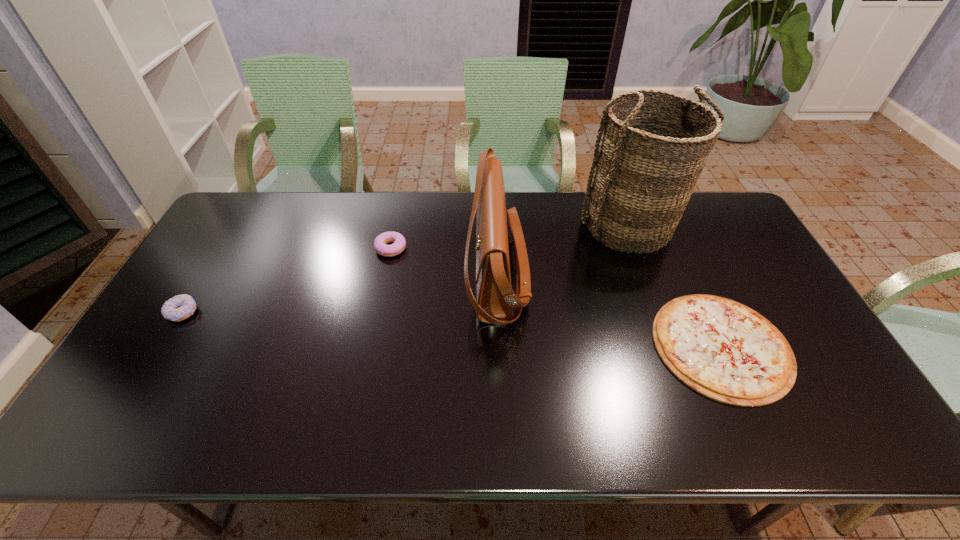
This screenshot has width=960, height=540. Find the location of `vacant position at the near edge of the desktop`. vacant position at the near edge of the desktop is located at coordinates (699, 444).

Where is `vacant space at the left edge of the desktop`? This screenshot has width=960, height=540. vacant space at the left edge of the desktop is located at coordinates (200, 282).

Locate an element on the screen. The height and width of the screenshot is (540, 960). vacant space at the right edge of the desktop is located at coordinates (810, 339).

The width and height of the screenshot is (960, 540). In the image, there is a desktop. What are the coordinates of `vacant space at the far right corner` in the screenshot? It's located at (690, 211).

This screenshot has height=540, width=960. What are the coordinates of `unoccupied area between the left doughnut and the basket` in the screenshot? It's located at (406, 269).

Identify the location of free spot between the second object from left to right and the shortest object. The image size is (960, 540). (556, 297).

What are the coordinates of `free spot between the third object from left to right and the fourth object from right to left` in the screenshot? It's located at (444, 261).

The height and width of the screenshot is (540, 960). In order to click on unoccupied area between the farther doughnut and the basket in this screenshot , I will do `click(510, 237)`.

Identify the location of empty space between the farther doughnut and the leftmost object. (286, 280).

Identify the location of vacant point located between the nearer doughnut and the farther doughnut. Image resolution: width=960 pixels, height=540 pixels. (286, 280).